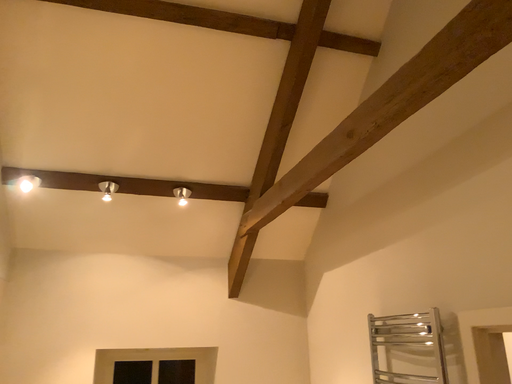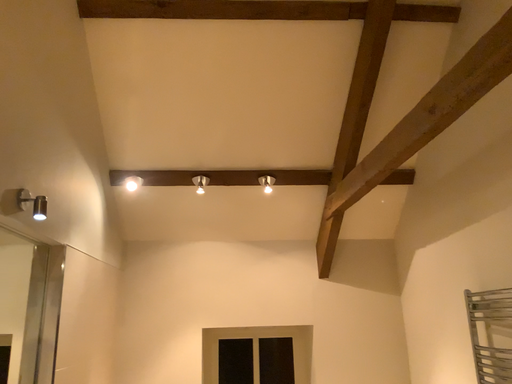
Question: Which way did the camera rotate in the video?

Choices:
 (A) rotated right
 (B) rotated left

Answer: (B)